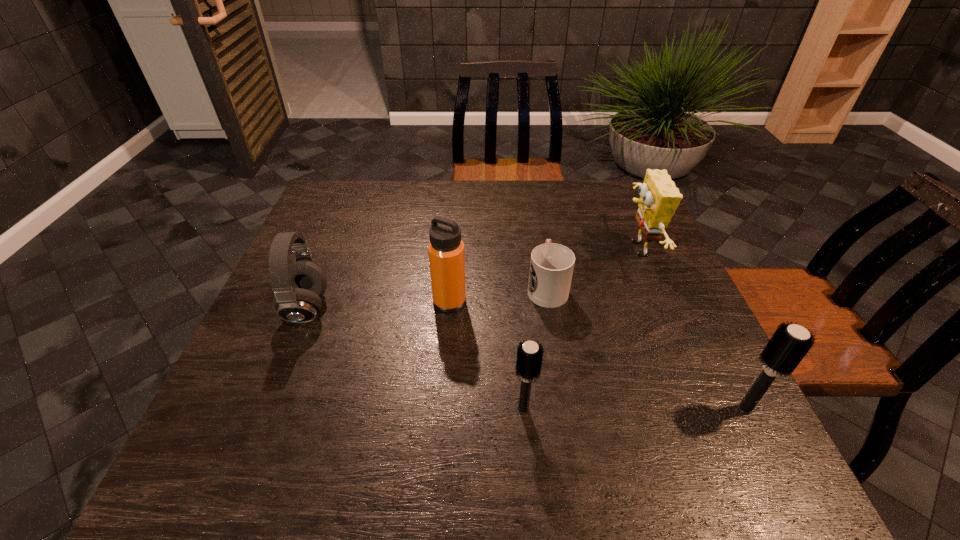
Find the location of a particular element. the shorter hairbrush is located at coordinates (529, 355).

You are a GUI agent. You are given a task and a screenshot of the screen. Output one action in this format:
    pyautogui.click(x=<x>, y=<y>)
    Task: Click on the fourth object from right to left
    
    Given the screenshot: What is the action you would take?
    pyautogui.click(x=529, y=355)

At what (x,y) coordinates should I click in order to perform the action: click on the right hairbrush. Please return your answer as a coordinate pair (x, y). The image size is (960, 540). Looking at the image, I should click on (789, 344).

Identify the location of the rightmost object. The height and width of the screenshot is (540, 960). (789, 344).

Locate an element on the screen. sponge is located at coordinates (659, 197).

Locate an element on the screen. Image resolution: width=960 pixels, height=540 pixels. thermos bottle is located at coordinates (446, 249).

This screenshot has width=960, height=540. In order to click on the leftmost object in this screenshot , I will do click(x=297, y=287).

Locate an element on the screen. The height and width of the screenshot is (540, 960). the fourth object from left to right is located at coordinates (551, 267).

Find the location of a particular element. The height and width of the screenshot is (540, 960). cup is located at coordinates (551, 267).

Where is `vacant space located 0.050m on the back of the fourth object from right to left`? This screenshot has height=540, width=960. vacant space located 0.050m on the back of the fourth object from right to left is located at coordinates (521, 377).